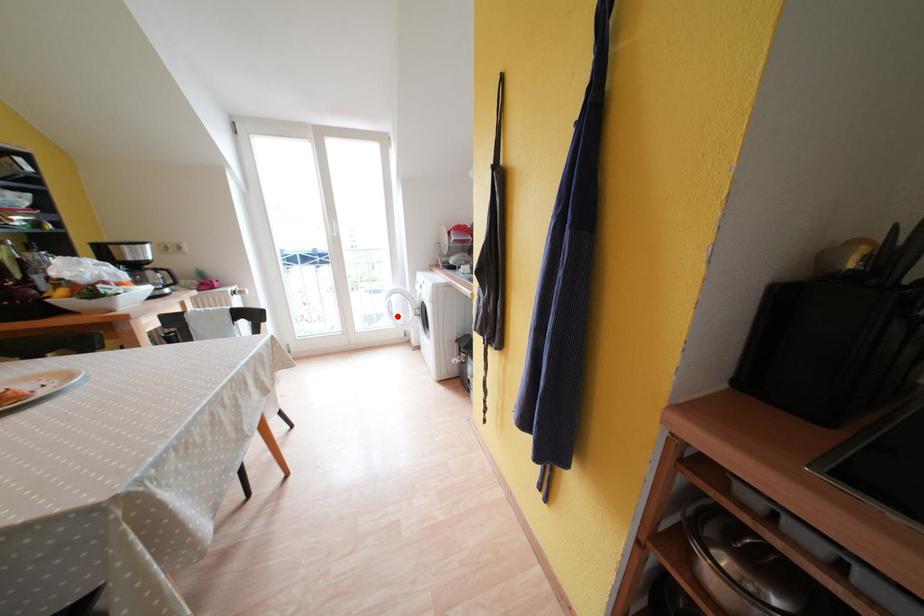
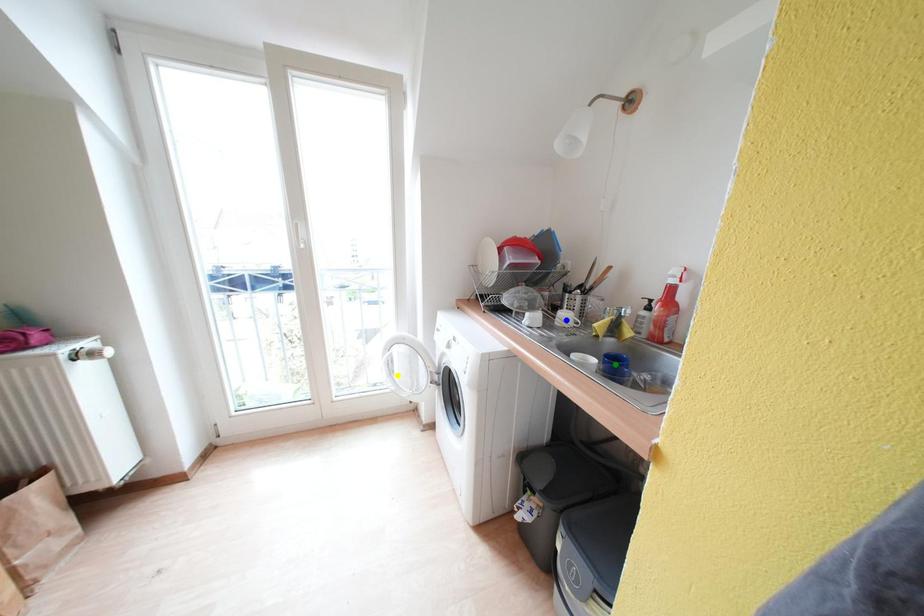
Question: I am providing you with two images of the same scene from different viewpoints. A red point is marked on the first image. You are given multiple points on the second image. Can you choose the point in image 2 that corresponds to the point in image 1?

Choices:
 (A) yellow point
 (B) blue point
 (C) green point

Answer: (A)